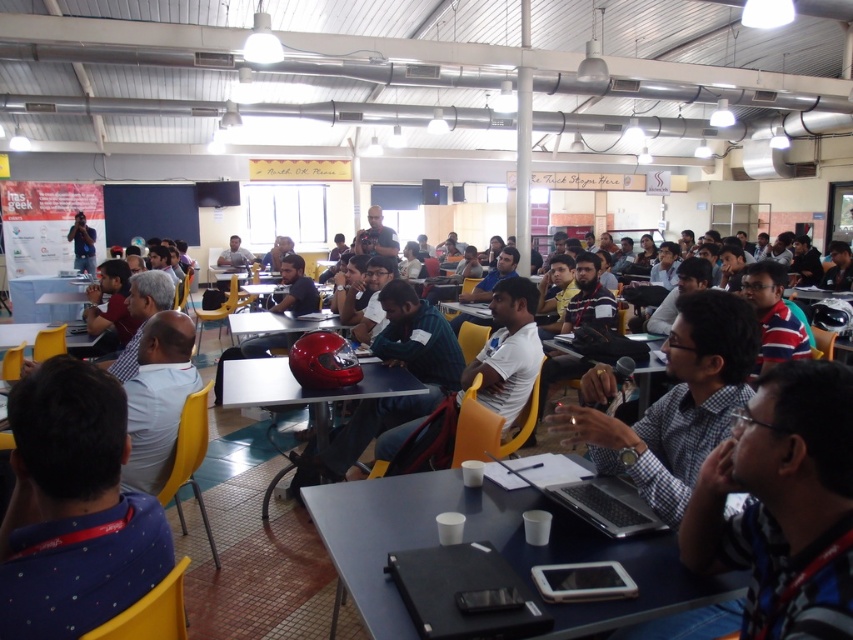
Which is behind, point (138, 538) or point (596, 516)?

The point (596, 516) is behind.

Does blue dotted shirt at center have a lesser width compared to silver metallic laptop at center?

No, blue dotted shirt at center is not thinner than silver metallic laptop at center.

Image resolution: width=853 pixels, height=640 pixels. I want to click on blue dotted shirt at center, so click(73, 508).

The height and width of the screenshot is (640, 853). What do you see at coordinates (158, 397) in the screenshot?
I see `white matte shirt at center` at bounding box center [158, 397].

Is white matte shirt at center thinner than matte black table at center?

Yes.

Describe the element at coordinates (158, 397) in the screenshot. This screenshot has width=853, height=640. I see `white matte shirt at center` at that location.

The width and height of the screenshot is (853, 640). What are the coordinates of `white matte shirt at center` in the screenshot? It's located at (158, 397).

The image size is (853, 640). What do you see at coordinates (73, 508) in the screenshot? I see `blue dotted shirt at center` at bounding box center [73, 508].

Does point (78, 406) come farther from viewer compared to point (86, 234)?

That is False.

Locate an element on the screen. This screenshot has height=640, width=853. blue dotted shirt at center is located at coordinates (73, 508).